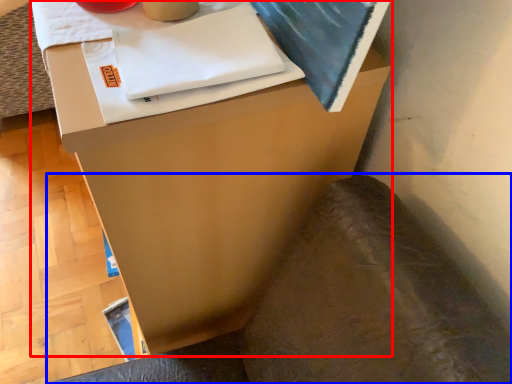
Question: Which object appears farthest to the camera in this image, furniture (highlighted by a red box) or swivel chair (highlighted by a blue box)?

Choices:
 (A) furniture
 (B) swivel chair

Answer: (A)